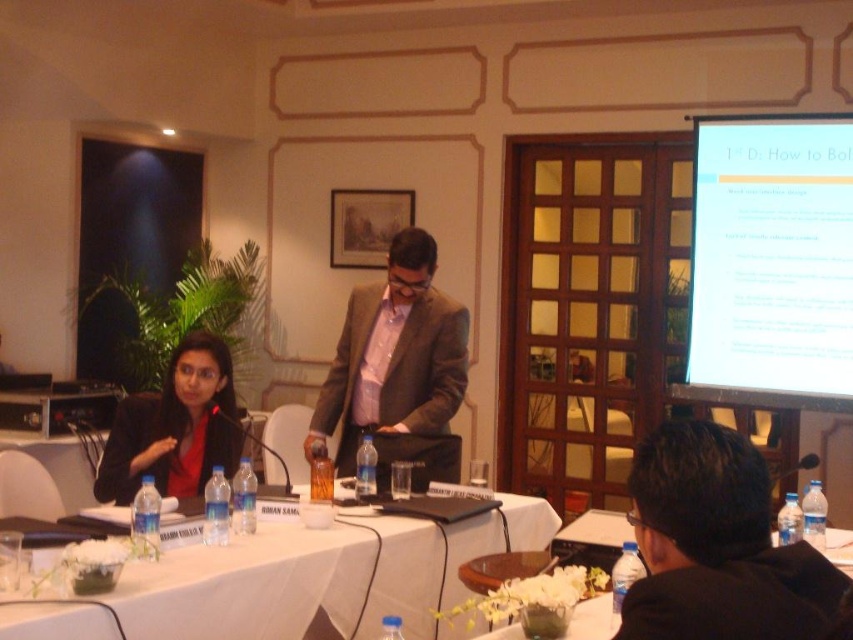
Can you confirm if white cloth table at center is smaller than brown textured suit at center?

Actually, white cloth table at center might be larger than brown textured suit at center.

Is white cloth table at center shorter than brown textured suit at center?

Yes, white cloth table at center is shorter than brown textured suit at center.

Between point (57, 616) and point (314, 435), which one is positioned in front?

Positioned in front is point (57, 616).

At what (x,y) coordinates should I click in order to perform the action: click on white cloth table at center. Please return your answer as a coordinate pair (x, y). The height and width of the screenshot is (640, 853). Looking at the image, I should click on (286, 582).

From the picture: Can you confirm if white cloth table at center is shorter than white glossy table at lower center?

Incorrect, white cloth table at center's height does not fall short of white glossy table at lower center's.

Does white cloth table at center have a smaller size compared to white glossy table at lower center?

Actually, white cloth table at center might be larger than white glossy table at lower center.

Is point (431, 579) positioned behind point (596, 596)?

Yes, it is behind point (596, 596).

At what (x,y) coordinates should I click in order to perform the action: click on white cloth table at center. Please return your answer as a coordinate pair (x, y). Looking at the image, I should click on 286,582.

Is black suit at lower right to the left of white glossy table at lower center from the viewer's perspective?

In fact, black suit at lower right is to the right of white glossy table at lower center.

In the scene shown: Measure the distance between black suit at lower right and camera.

black suit at lower right is 1.06 meters away from camera.

Does point (779, 557) come closer to viewer compared to point (838, 536)?

Yes, point (779, 557) is in front of point (838, 536).

Where is `black suit at lower right`? The image size is (853, 640). black suit at lower right is located at coordinates (717, 545).